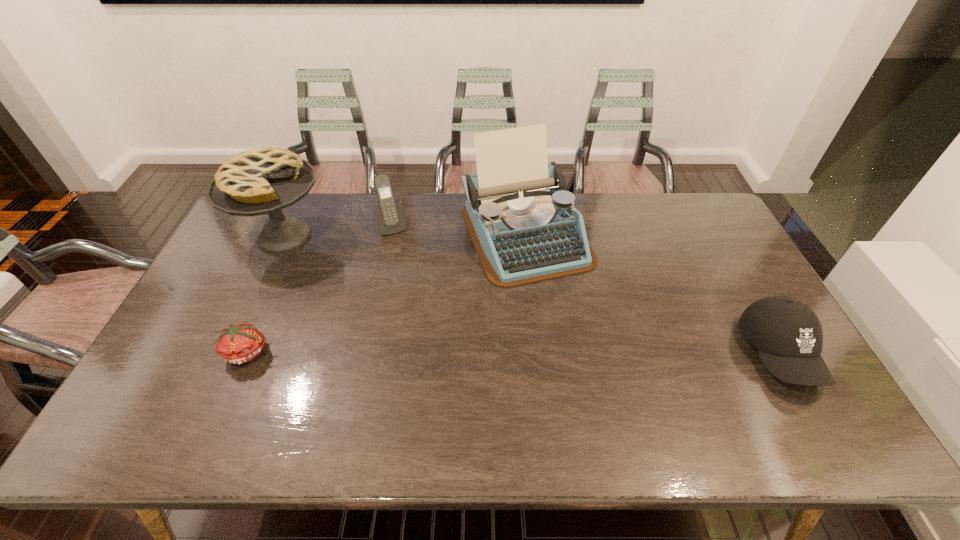
Identify the location of vacant region located on the front-facing side of the third object from left to right. The image size is (960, 540). (417, 282).

Find the location of a particular element. The height and width of the screenshot is (540, 960). free location located 0.110m on the typing side of the second object from right to left is located at coordinates (564, 313).

Identify the location of vacant space located 0.060m on the typing side of the second object from right to left. The image size is (960, 540). (558, 300).

You are a GUI agent. You are given a task and a screenshot of the screen. Output one action in this format:
    pyautogui.click(x=<x>, y=<y>)
    Task: Click on the vacant space located on the typing side of the second object from right to left
    The image size is (960, 540).
    Given the screenshot: What is the action you would take?
    pyautogui.click(x=573, y=329)

The height and width of the screenshot is (540, 960). I want to click on free space located on the cut side of the pie, so click(x=347, y=284).

Where is `free space located 0.250m on the cut side of the pie`? The height and width of the screenshot is (540, 960). free space located 0.250m on the cut side of the pie is located at coordinates (361, 295).

Image resolution: width=960 pixels, height=540 pixels. In order to click on vacant space situated on the cut side of the pie in this screenshot , I will do pyautogui.click(x=350, y=287).

This screenshot has height=540, width=960. Identify the location of cellular telephone at the far edge. (390, 215).

Locate an element on the screen. This screenshot has width=960, height=540. typewriter that is at the far edge is located at coordinates (524, 226).

The image size is (960, 540). I want to click on pie situated at the far edge, so click(258, 181).